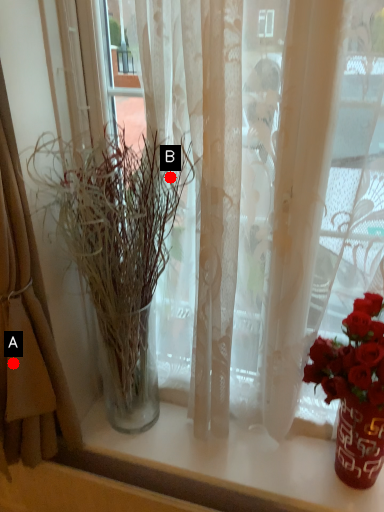
Question: Two points are circled on the image, labeled by A and B beside each circle. Among these points, which one is farthest from the camera?

Choices:
 (A) A is further
 (B) B is further

Answer: (B)